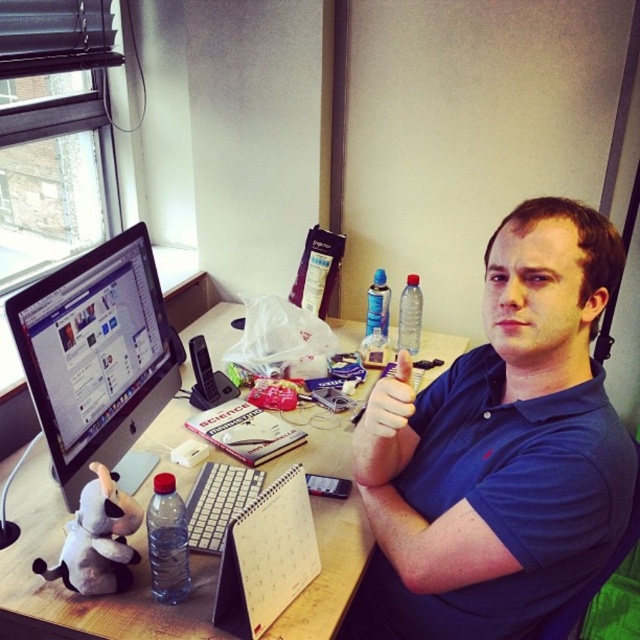
Question: Is clear plastic water bottle at upper right to the right of blue plastic spray can at upper center from the viewer's perspective?

Choices:
 (A) no
 (B) yes

Answer: (B)

Question: Which point is closer to the camera?

Choices:
 (A) white plush toy at lower left
 (B) transparent plastic bottle at lower left

Answer: (B)

Question: Is matte black monitor at left to the right of white plush toy at lower left from the viewer's perspective?

Choices:
 (A) yes
 (B) no

Answer: (B)

Question: Does woodendesk at center appear under matte black monitor at left?

Choices:
 (A) no
 (B) yes

Answer: (B)

Question: Among these objects, which one is nearest to the camera?

Choices:
 (A) white plush toy at lower left
 (B) blue plastic spray can at upper center
 (C) woodendesk at center
 (D) transparent plastic bottle at lower left

Answer: (D)

Question: Considering the real-world distances, which object is closest to the matte black monitor at left?

Choices:
 (A) transparent plastic bottle at lower left
 (B) white plush toy at lower left
 (C) blue cotton shirt at center
 (D) clear plastic water bottle at upper right

Answer: (B)